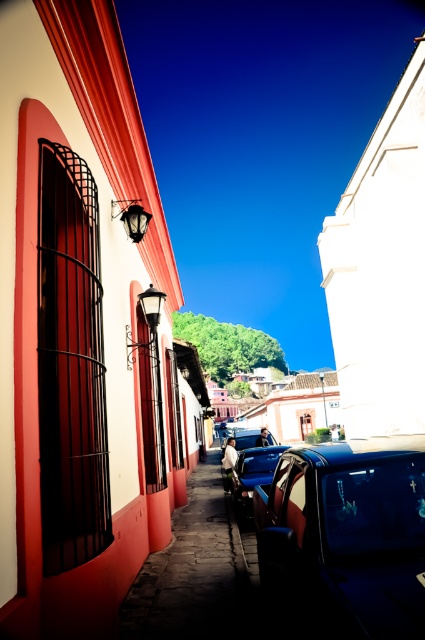
You are a photographer trying to capture both cars in the frame. Since the glossy blue car at center and the metallic blue car at center are both at the center, which one will appear smaller in your photo?

The glossy blue car at center appears smaller because it is not as tall as the metallic blue car at center.

You are a tourist standing on the cobblestone street and want to take a photo of both the shiny blue car at center and the glossy blue car at center. Which car should you focus on first to ensure both are in the frame?

You should focus on the shiny blue car at center first since it is closer to you than the glossy blue car at center, ensuring both are within the camera frame.

You are standing on the cobblestone street in the historic town and see two points marked on the ground. The first point is at coordinates point (144, 584) and the second is at point (240, 496). Which point is closer to you?

Point (144, 584) is in front of point (240, 496), so it is closer to you.